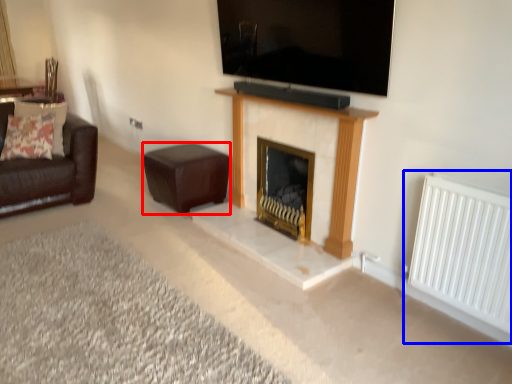
Question: Which point is closer to the camera, stool (highlighted by a red box) or radiator (highlighted by a blue box)?

Choices:
 (A) stool
 (B) radiator

Answer: (B)